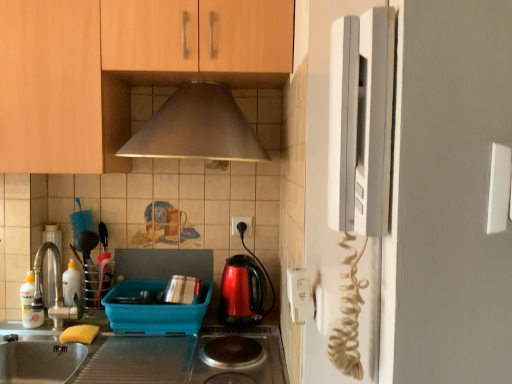
Question: Is shiny metallic stove at center oriented away from satin steel sink at lower left?

Choices:
 (A) no
 (B) yes

Answer: (A)

Question: Could you tell me if shiny metallic stove at center is turned towards satin steel sink at lower left?

Choices:
 (A) yes
 (B) no

Answer: (B)

Question: Does shiny metallic stove at center have a larger size compared to satin steel sink at lower left?

Choices:
 (A) yes
 (B) no

Answer: (B)

Question: Does shiny metallic stove at center have a greater width compared to satin steel sink at lower left?

Choices:
 (A) no
 (B) yes

Answer: (B)

Question: Is shiny metallic stove at center surrounding satin steel sink at lower left?

Choices:
 (A) no
 (B) yes

Answer: (A)

Question: Are shiny metallic stove at center and satin steel sink at lower left located far from each other?

Choices:
 (A) no
 (B) yes

Answer: (A)

Question: Is shiny metallic stove at center beside white glossy bottle at sink left, positioned as the second bottle in back-to-front order?

Choices:
 (A) yes
 (B) no

Answer: (B)

Question: From the image's perspective, is shiny metallic stove at center below white glossy bottle at sink left, which is the first bottle in left-to-right order?

Choices:
 (A) yes
 (B) no

Answer: (A)

Question: Is shiny metallic stove at center located outside white glossy bottle at sink left, positioned as the second bottle in back-to-front order?

Choices:
 (A) yes
 (B) no

Answer: (A)

Question: Is shiny metallic stove at center oriented away from white glossy bottle at sink left, which appears as the 2th bottle when viewed from the right?

Choices:
 (A) yes
 (B) no

Answer: (B)

Question: From a real-world perspective, is shiny metallic stove at center on top of white glossy bottle at sink left, positioned as the second bottle in back-to-front order?

Choices:
 (A) no
 (B) yes

Answer: (A)

Question: From a real-world perspective, is shiny metallic stove at center below white glossy bottle at sink left, which is the first bottle in left-to-right order?

Choices:
 (A) yes
 (B) no

Answer: (A)

Question: Is satin steel sink at lower left thinner than white plastic electric outlet at center, which is counted as the second electric outlet, starting from the right?

Choices:
 (A) no
 (B) yes

Answer: (A)